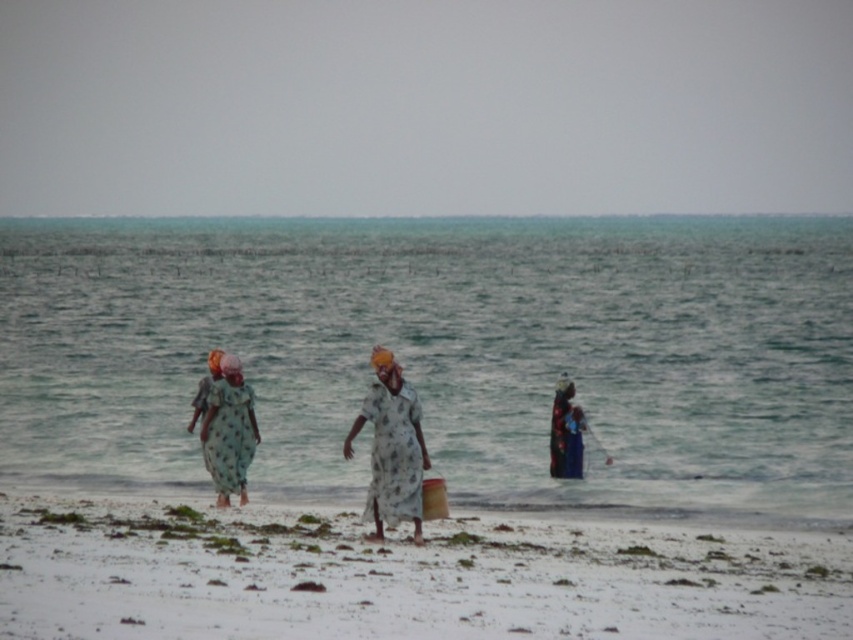
Question: Based on their relative distances, which object is farther from the printed fabric dress at left?

Choices:
 (A) blue fabric dress at center
 (B) white floral dress at center

Answer: (A)

Question: Does white sandy beach at lower center have a smaller size compared to printed fabric dress at left?

Choices:
 (A) yes
 (B) no

Answer: (B)

Question: Among these objects, which one is nearest to the camera?

Choices:
 (A) clear water at center
 (B) white floral dress at center
 (C) printed fabric dress at left
 (D) blue fabric dress at center

Answer: (B)

Question: Which point is farther to the camera?

Choices:
 (A) (541, 637)
 (B) (223, 435)
 (C) (381, 442)

Answer: (B)

Question: Does printed fabric dress at left appear over blue fabric dress at center?

Choices:
 (A) yes
 (B) no

Answer: (A)

Question: Can you confirm if clear water at center is wider than white floral dress at center?

Choices:
 (A) yes
 (B) no

Answer: (A)